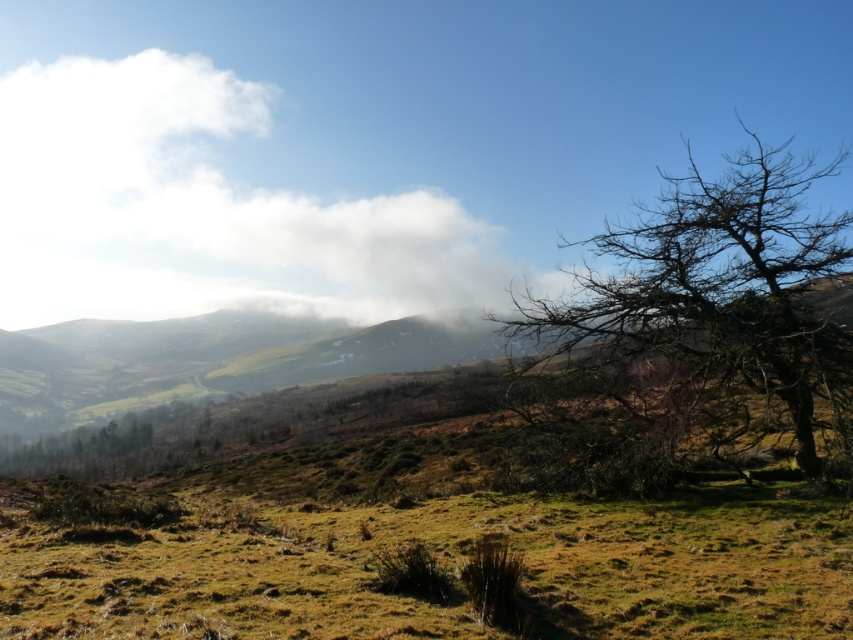
You are standing in the middle of the grassy field and want to take a photo of the white fluffy cloud at upper left and the bare branches at right. Which object is farther from your current position?

The white fluffy cloud at upper left is 125.19 meters away from the bare branches at right. Since the distance between them is given, but your position is in the middle, it depends on their individual distances from you. However, clouds are typically much farther than terrestrial objects like trees, so the white fluffy cloud at upper left is farther away.

You are standing in the middle of the grassy field in the scene and see two points marked in the image. Which point, point [349,196] or point [758,310], is closer to you?

Point [349,196] is further to the camera than point [758,310], so the point closer to you is point [758,310].